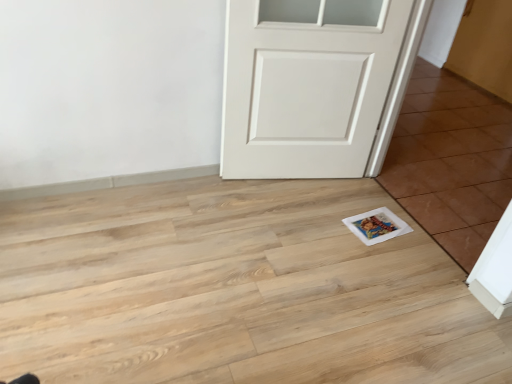
Where is `white painted wood door at center`? This screenshot has width=512, height=384. white painted wood door at center is located at coordinates (307, 85).

Measure the distance between white painted wood door at center and camera.

white painted wood door at center and camera are 1.81 meters apart.

What do you see at coordinates (307, 85) in the screenshot? This screenshot has width=512, height=384. I see `white painted wood door at center` at bounding box center [307, 85].

What do you see at coordinates (451, 160) in the screenshot? I see `white glossy tile at lower right` at bounding box center [451, 160].

Locate an element on the screen. white glossy tile at lower right is located at coordinates pos(451,160).

Identify the location of white painted wood door at center. (307, 85).

Does white glossy tile at lower right appear on the left side of white painted wood door at center?

Incorrect, white glossy tile at lower right is not on the left side of white painted wood door at center.

Is white glossy tile at lower right closer to the viewer compared to white painted wood door at center?

That is True.

Does point (473, 89) come in front of point (301, 142)?

No, it is not.

Based on the photo, from the image's perspective, is white glossy tile at lower right located beneath white painted wood door at center?

Yes, from the image's perspective, white glossy tile at lower right is below white painted wood door at center.

From a real-world perspective, is white glossy tile at lower right located beneath white painted wood door at center?

No, from a real-world perspective, white glossy tile at lower right is not under white painted wood door at center.

Between white glossy tile at lower right and white painted wood door at center, which one has smaller width?

white glossy tile at lower right.

Considering the sizes of white glossy tile at lower right and white painted wood door at center in the image, is white glossy tile at lower right taller or shorter than white painted wood door at center?

Considering their sizes, white glossy tile at lower right has less height than white painted wood door at center.

Is white glossy tile at lower right smaller than white painted wood door at center?

Yes, white glossy tile at lower right is smaller than white painted wood door at center.

Is white glossy tile at lower right positioned beyond the bounds of white painted wood door at center?

Yes, white glossy tile at lower right is not within white painted wood door at center.

Are white glossy tile at lower right and white painted wood door at center located far from each other?

That's not correct — white glossy tile at lower right is a little close to white painted wood door at center.

Could you tell me if white glossy tile at lower right is turned towards white painted wood door at center?

Yes, white glossy tile at lower right faces towards white painted wood door at center.

What's the angular difference between white glossy tile at lower right and white painted wood door at center's facing directions?

77.9 degrees separate the facing orientations of white glossy tile at lower right and white painted wood door at center.

Locate an element on the screen. Image resolution: width=512 pixels, height=384 pixels. tile that appears on the right of white painted wood door at center is located at coordinates (451, 160).

Based on their positions, is white painted wood door at center located to the left or right of white glossy tile at lower right?

white painted wood door at center is to the left of white glossy tile at lower right.

Is white painted wood door at center in front of white glossy tile at lower right?

No, it is not.

Considering the positions of points (344, 82) and (433, 120), is point (344, 82) farther from camera compared to point (433, 120)?

No, (344, 82) is in front of (433, 120).

From the image's perspective, between white painted wood door at center and white glossy tile at lower right, who is located below?

From the image's view, white glossy tile at lower right is below.

From a real-world perspective, is white painted wood door at center located beneath white glossy tile at lower right?

Indeed, from a real-world perspective, white painted wood door at center is positioned beneath white glossy tile at lower right.

Considering the sizes of objects white painted wood door at center and white glossy tile at lower right in the image provided, who is wider, white painted wood door at center or white glossy tile at lower right?

white painted wood door at center.

From the picture: Considering the sizes of white painted wood door at center and white glossy tile at lower right in the image, is white painted wood door at center taller or shorter than white glossy tile at lower right?

white painted wood door at center is taller than white glossy tile at lower right.

Who is bigger, white painted wood door at center or white glossy tile at lower right?

white painted wood door at center.

Is white painted wood door at center outside of white glossy tile at lower right?

Yes, white painted wood door at center is not within white glossy tile at lower right.

From the picture: Is white painted wood door at center in contact with white glossy tile at lower right?

No, white painted wood door at center is not beside white glossy tile at lower right.

Is white painted wood door at center facing towards white glossy tile at lower right?

No, white painted wood door at center is not facing towards white glossy tile at lower right.

What's the angular difference between white painted wood door at center and white glossy tile at lower right's facing directions?

77.9 degrees.

Where is `tile above the white painted wood door at center (from a real-world perspective)`? The width and height of the screenshot is (512, 384). tile above the white painted wood door at center (from a real-world perspective) is located at coordinates (x=451, y=160).

There is a white painted wood door at center. In order to click on tile above it (from a real-world perspective) in this screenshot , I will do `click(451, 160)`.

Locate an element on the screen. This screenshot has width=512, height=384. door above the white glossy tile at lower right (from the image's perspective) is located at coordinates (307, 85).